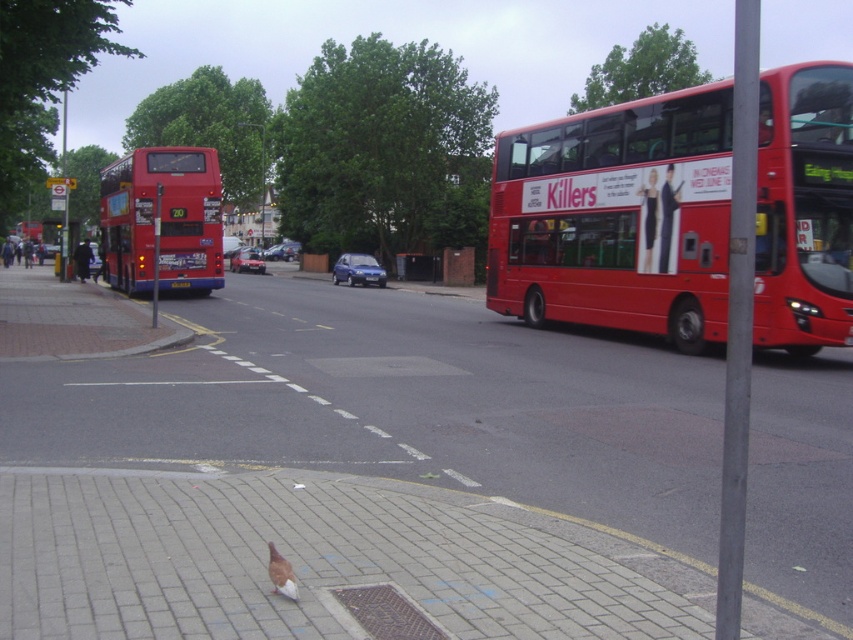
Question: From the image, what is the correct spatial relationship of matte red bus at left in relation to brown feathered pigeon at lower center?

Choices:
 (A) left
 (B) right

Answer: (A)

Question: Estimate the real-world distances between objects in this image. Which object is closer to the brown feathered pigeon at lower center?

Choices:
 (A) red matte bus at right
 (B) matte red bus at left

Answer: (A)

Question: Which is farther from the red matte bus at right?

Choices:
 (A) brown feathered pigeon at lower center
 (B) matte red bus at left

Answer: (A)

Question: Considering the relative positions of matte red bus at left and brown feathered pigeon at lower center in the image provided, where is matte red bus at left located with respect to brown feathered pigeon at lower center?

Choices:
 (A) above
 (B) below

Answer: (A)

Question: Can you confirm if matte red bus at left is bigger than brown feathered pigeon at lower center?

Choices:
 (A) no
 (B) yes

Answer: (B)

Question: Which object appears farthest from the camera in this image?

Choices:
 (A) red matte bus at right
 (B) matte red bus at left

Answer: (B)